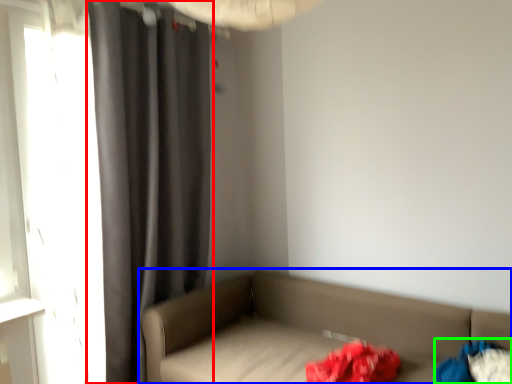
Question: Estimate the real-world distances between objects in this image. Which object is closer to curtain (highlighted by a red box), studio couch (highlighted by a blue box) or clothing (highlighted by a green box)?

Choices:
 (A) studio couch
 (B) clothing

Answer: (A)